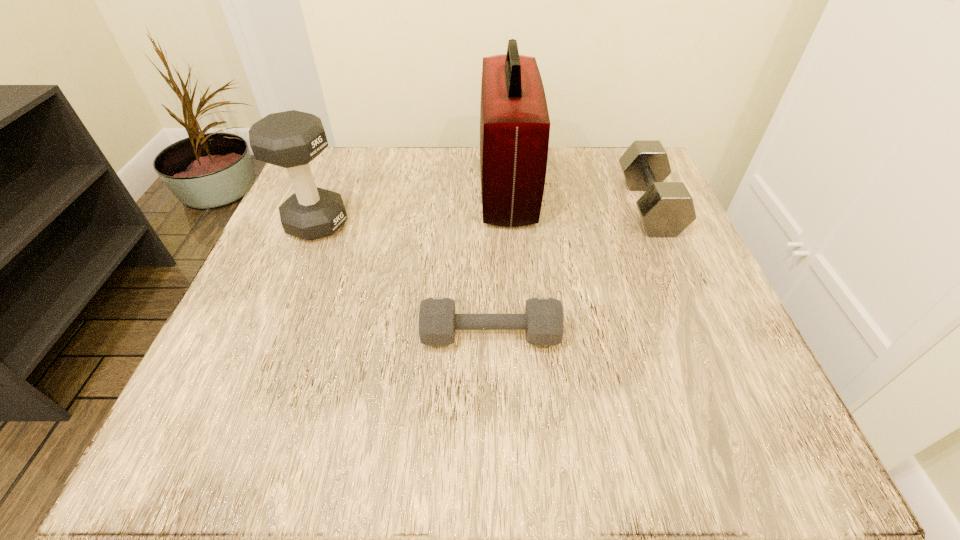
The width and height of the screenshot is (960, 540). What are the coordinates of `the tallest object` in the screenshot? It's located at 514,121.

Where is `the leftmost object`? the leftmost object is located at coordinates (291, 139).

Locate an element on the screen. This screenshot has height=540, width=960. the leftmost dumbbell is located at coordinates 291,139.

The height and width of the screenshot is (540, 960). In order to click on the second shortest dumbbell in this screenshot , I will do `click(666, 209)`.

The height and width of the screenshot is (540, 960). I want to click on the rightmost dumbbell, so click(666, 209).

This screenshot has width=960, height=540. I want to click on the second dumbbell from right to left, so click(543, 320).

The height and width of the screenshot is (540, 960). I want to click on the shortest dumbbell, so (543, 320).

At what (x,y) coordinates should I click in order to perform the action: click on vacant region located on the side of the first aid kit with the cross symbol. Please return your answer as a coordinate pair (x, y). This screenshot has height=540, width=960. Looking at the image, I should click on (383, 187).

At what (x,y) coordinates should I click in order to perform the action: click on free space located on the side of the first aid kit with the cross symbol. Please return your answer as a coordinate pair (x, y). This screenshot has height=540, width=960. Looking at the image, I should click on (457, 187).

Image resolution: width=960 pixels, height=540 pixels. Find the location of `free space located on the side of the first aid kit with the cross symbol`. free space located on the side of the first aid kit with the cross symbol is located at coordinates (301, 187).